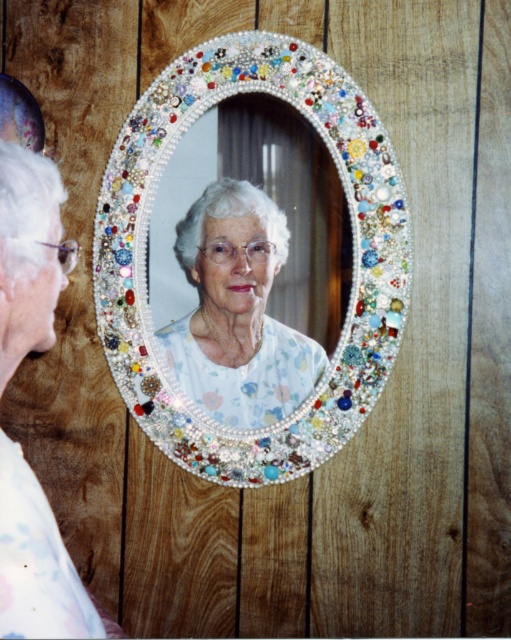
You are an interior designer assessing the placement of the floral fabric blouse at center in the room. Based on its coordinates, can you determine if it is positioned closer to the top or bottom of the mirror?

The floral fabric blouse at center is located at point (238, 310), which places it near the center of the mirror, so it is neither closer to the top nor the bottom.